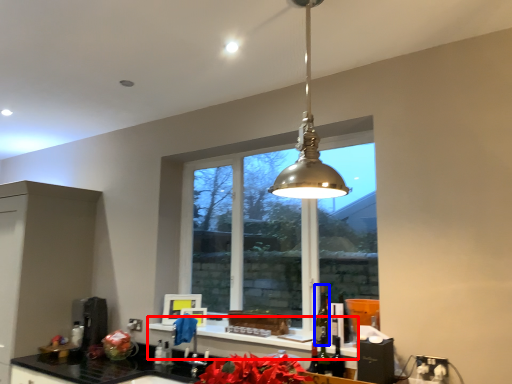
Question: Which of the following is the closest to the observer, window sill (highlighted by a red box) or alcohol (highlighted by a blue box)?

Choices:
 (A) window sill
 (B) alcohol

Answer: (A)